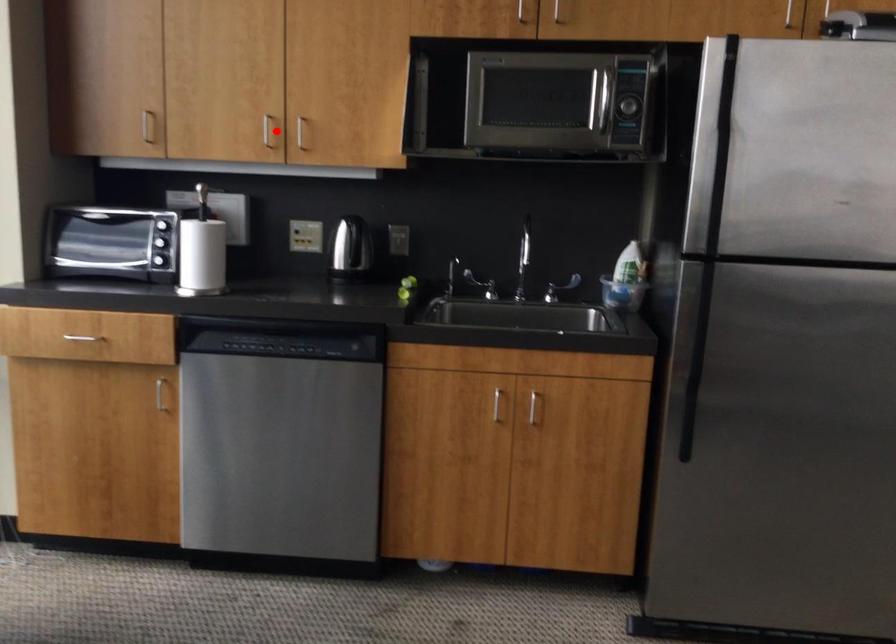
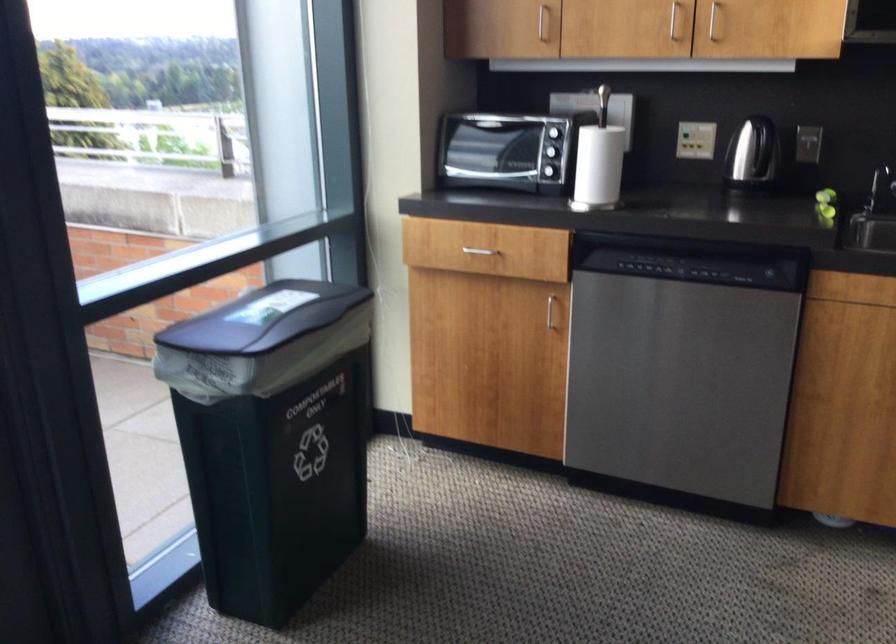
Question: I am providing you with two images of the same scene from different viewpoints. Image1 has a red point marked. In image2, the corresponding 3D location appears at what relative position? Reply with the corresponding letter.

Choices:
 (A) Closer
 (B) Farther

Answer: (A)